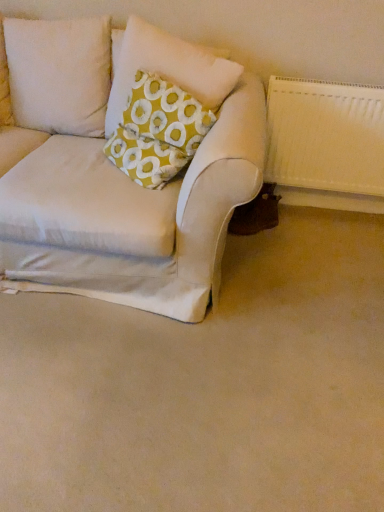
Question: Is white textured radiator at right taller or shorter than yellow fabric pillow at upper left?

Choices:
 (A) short
 (B) tall

Answer: (B)

Question: Based on their sizes in the image, would you say white textured radiator at right is bigger or smaller than yellow fabric pillow at upper left?

Choices:
 (A) big
 (B) small

Answer: (B)

Question: Estimate the real-world distances between objects in this image. Which object is farther from the beige fabric couch at lower left?

Choices:
 (A) yellow fabric pillow at upper left
 (B) white textured radiator at right

Answer: (A)

Question: Which object is positioned closest to the beige fabric couch at lower left?

Choices:
 (A) white textured radiator at right
 (B) yellow fabric pillow at upper left

Answer: (A)